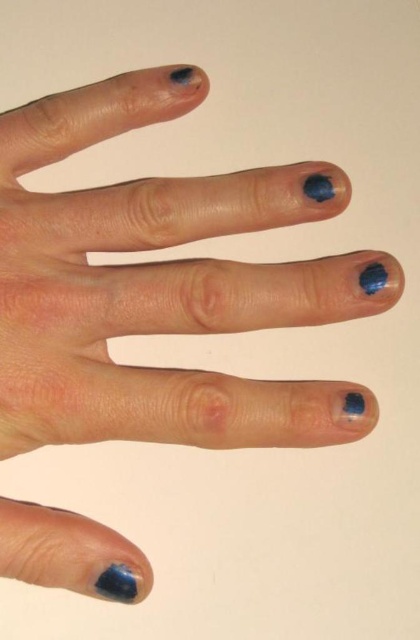
Between matte blue nail polish at upper right and matte blue nail polish at lower right, which one is positioned lower?

matte blue nail polish at lower right

Based on the photo, does matte blue nail polish at upper right have a lesser width compared to matte blue nail polish at lower right?

Yes.

The width and height of the screenshot is (420, 640). Find the location of `matte blue nail polish at upper right`. matte blue nail polish at upper right is located at coordinates (372, 276).

Between matte blue nail polish at upper center and matte blue nail polish at lower right, which one is positioned higher?

Positioned higher is matte blue nail polish at upper center.

Is matte blue nail polish at upper center positioned behind matte blue nail polish at lower right?

Yes, it is behind matte blue nail polish at lower right.

Does point (309, 188) lie in front of point (352, 397)?

That is False.

Find the location of a particular element. matte blue nail polish at upper center is located at coordinates (319, 188).

Can you confirm if matte blue nail polish at upper center is positioned to the left of matte blue nail polish at upper right?

Yes, matte blue nail polish at upper center is to the left of matte blue nail polish at upper right.

Which is in front, point (319, 172) or point (385, 282)?

Positioned in front is point (385, 282).

Locate an element on the screen. The height and width of the screenshot is (640, 420). matte blue nail polish at upper center is located at coordinates (319, 188).